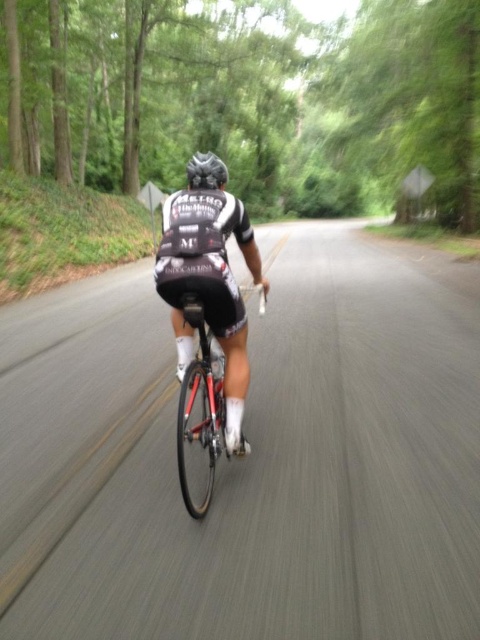
Based on the photo, is black matte cycling jersey at center wider than shiny red bicycle at center?

Yes, black matte cycling jersey at center is wider than shiny red bicycle at center.

Who is positioned more to the left, black matte cycling jersey at center or shiny red bicycle at center?

From the viewer's perspective, shiny red bicycle at center appears more on the left side.

I want to click on black matte cycling jersey at center, so click(x=210, y=284).

Find the location of `black matte cycling jersey at center`. black matte cycling jersey at center is located at coordinates point(210,284).

Which is below, shiny red bicycle at center or black matte helmet at center?

shiny red bicycle at center is lower down.

Is shiny red bicycle at center wider than black matte helmet at center?

No.

Between point (211, 449) and point (187, 177), which one is positioned in front?

Point (211, 449)

At what (x,y) coordinates should I click in order to perform the action: click on shiny red bicycle at center. Please return your answer as a coordinate pair (x, y). Image resolution: width=480 pixels, height=640 pixels. Looking at the image, I should click on 201,404.

Between black matte cycling jersey at center and black matte helmet at center, which one appears on the right side from the viewer's perspective?

black matte cycling jersey at center is more to the right.

Where is `black matte cycling jersey at center`? black matte cycling jersey at center is located at coordinates (210, 284).